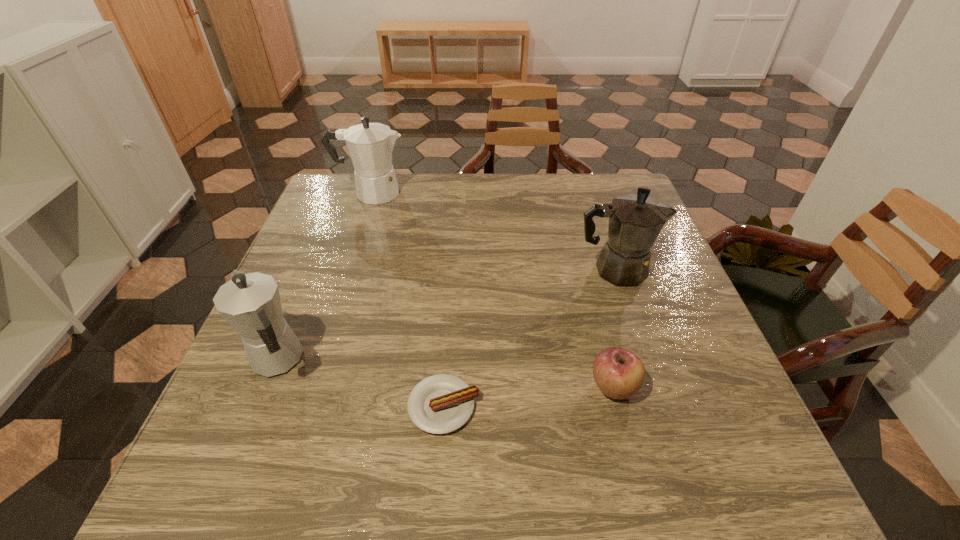
The width and height of the screenshot is (960, 540). Identify the location of free space between the second shortest object and the shortest object. (529, 397).

The height and width of the screenshot is (540, 960). Identify the location of blank region between the fourth nearest object and the shortest object. (530, 338).

The width and height of the screenshot is (960, 540). I want to click on unoccupied area between the nearest coffeepot and the farthest coffeepot, so click(325, 277).

You are a GUI agent. You are given a task and a screenshot of the screen. Output one action in this format:
    pyautogui.click(x=<x>, y=<y>)
    Task: Click on the vacant space in between the third object from left to right and the farthest object
    The height and width of the screenshot is (540, 960).
    Given the screenshot: What is the action you would take?
    pyautogui.click(x=407, y=299)

Where is `free space between the second shortest object and the farthest coffeepot`? The height and width of the screenshot is (540, 960). free space between the second shortest object and the farthest coffeepot is located at coordinates (492, 290).

Locate an element on the screen. This screenshot has height=540, width=960. free space between the sausage and the farthest object is located at coordinates (407, 299).

Where is `empty space that is in between the sausage and the fourth tallest object`? The width and height of the screenshot is (960, 540). empty space that is in between the sausage and the fourth tallest object is located at coordinates (x=529, y=397).

Find the location of a particular element. Image resolution: width=960 pixels, height=540 pixels. vacant area that lies between the third object from left to right and the second shortest object is located at coordinates coord(529,397).

At what (x,y) coordinates should I click in order to perform the action: click on free space that is in between the rightmost coffeepot and the third object from left to right. Please return your answer as a coordinate pair (x, y). This screenshot has width=960, height=540. Looking at the image, I should click on (530, 338).

You are a GUI agent. You are given a task and a screenshot of the screen. Output one action in this format:
    pyautogui.click(x=<x>, y=<y>)
    Task: Click on the closest object to the second nearest coffeepot
    This screenshot has height=540, width=960.
    Given the screenshot: What is the action you would take?
    pyautogui.click(x=619, y=374)